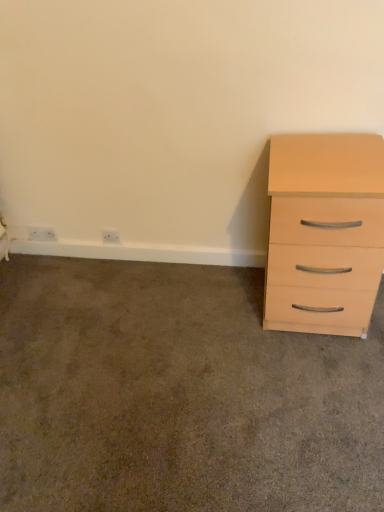
This screenshot has width=384, height=512. What are the coordinates of `vacant space to the left of light wood/finish chest of drawers at right` in the screenshot? It's located at pyautogui.click(x=218, y=312).